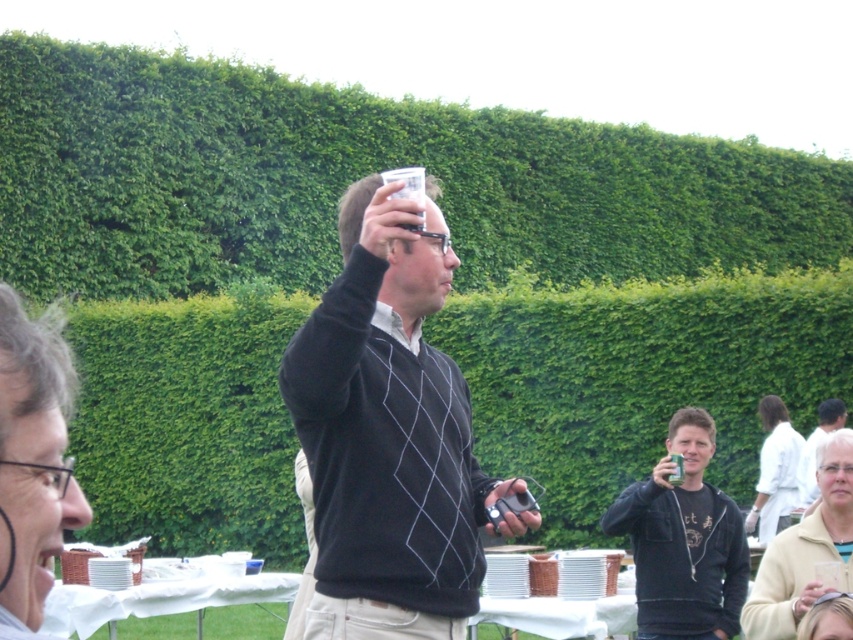
Question: Which point is farther to the camera?

Choices:
 (A) white textured shirt at lower right
 (B) khaki sweater at lower right
 (C) matte black sweater at upper center
 (D) black matte shirt at center

Answer: (A)

Question: Is dark gray sweater at center to the right of white textured shirt at lower right from the viewer's perspective?

Choices:
 (A) no
 (B) yes

Answer: (A)

Question: Which point is farther to the camera?

Choices:
 (A) dark gray sweater at center
 (B) white textured shirt at lower right

Answer: (B)

Question: Among these objects, which one is nearest to the camera?

Choices:
 (A) black matte shirt at center
 (B) matte black sweater at upper center
 (C) dark gray sweater at center
 (D) khaki sweater at lower right

Answer: (B)

Question: Can you confirm if matte black sweater at upper center is positioned to the left of khaki sweater at lower right?

Choices:
 (A) yes
 (B) no

Answer: (A)

Question: Can you confirm if dark gray sweater at center is positioned to the left of black matte shirt at center?

Choices:
 (A) no
 (B) yes

Answer: (B)